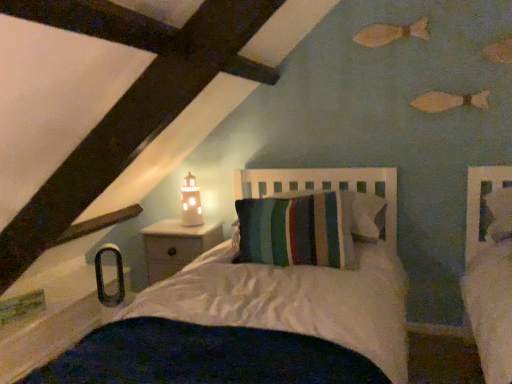
Question: Considering the positions of striped fabric pillow at center and matte white lighthouse at upper center in the image, is striped fabric pillow at center bigger or smaller than matte white lighthouse at upper center?

Choices:
 (A) small
 (B) big

Answer: (B)

Question: From a real-world perspective, is striped fabric pillow at center above or below matte white lighthouse at upper center?

Choices:
 (A) below
 (B) above

Answer: (A)

Question: Estimate the real-world distances between objects in this image. Which object is closer to the white wood nightstand at lower left?

Choices:
 (A) matte white lighthouse at upper center
 (B) striped fabric pillow at center

Answer: (A)

Question: Estimate the real-world distances between objects in this image. Which object is closer to the striped fabric pillow at center?

Choices:
 (A) matte white lighthouse at upper center
 (B) white wood nightstand at lower left

Answer: (B)